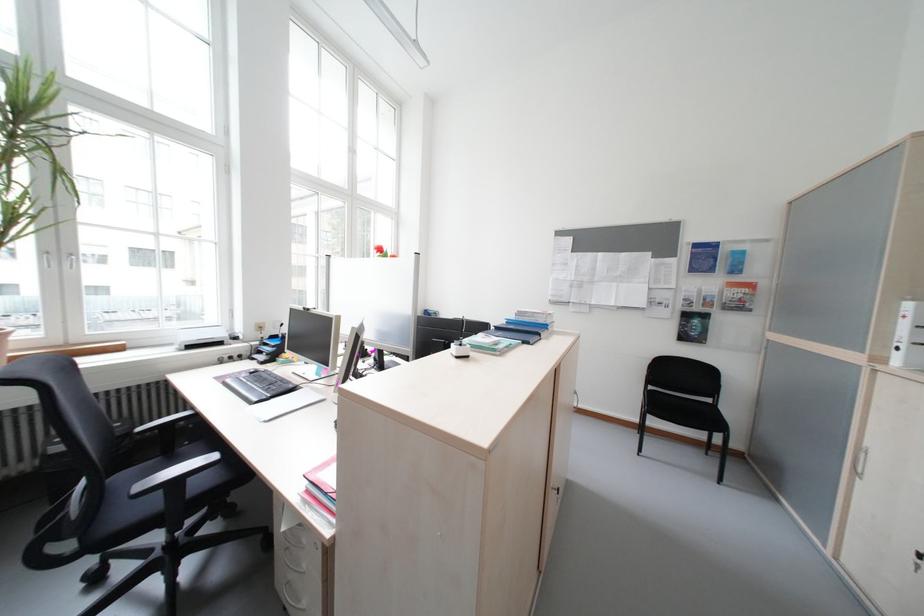
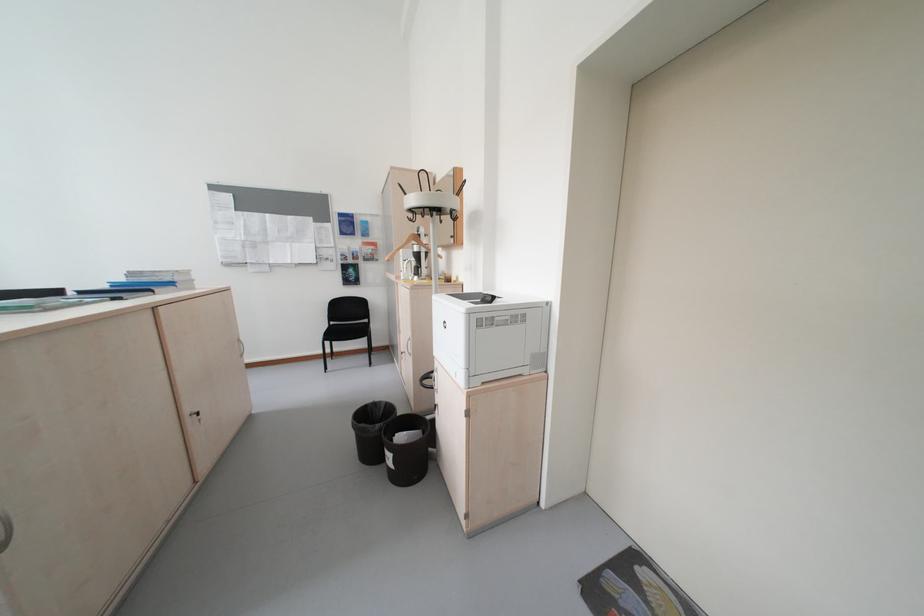
The point at [537,321] is marked in the first image. Where is the corresponding point in the second image?

(155, 281)